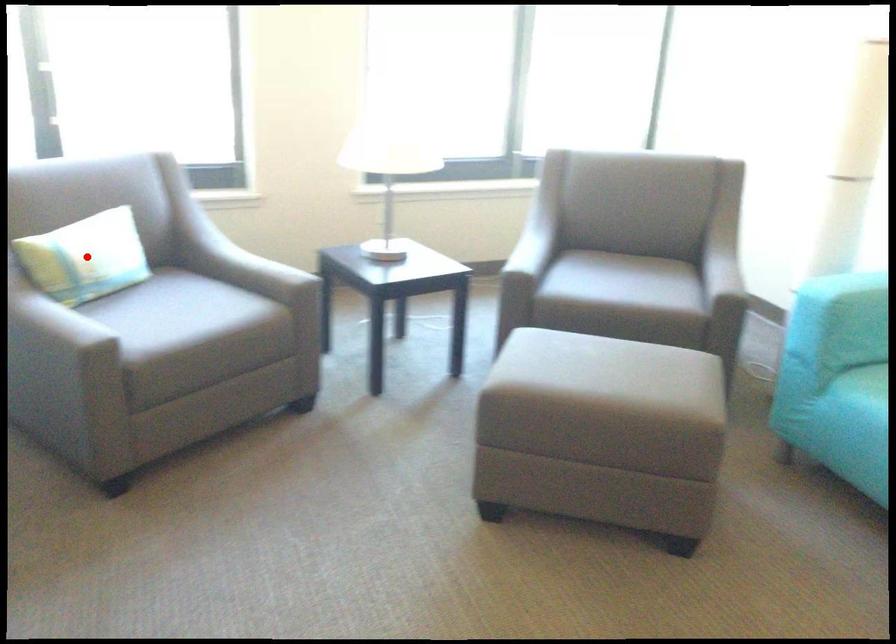
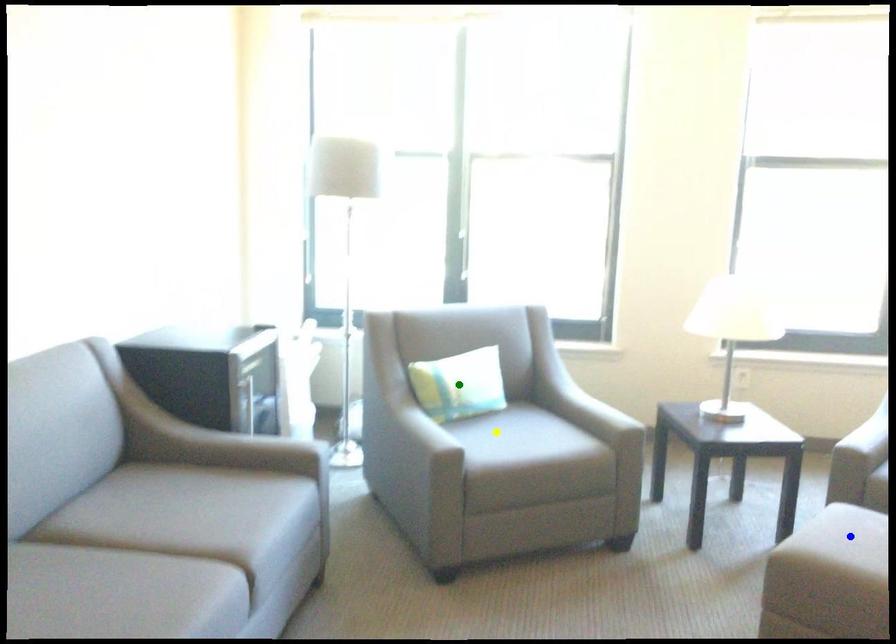
Question: I am providing you with two images of the same scene from different viewpoints. A red point is marked on the first image. You are given multiple points on the second image. Which point in image 2 is actually the same real-world point as the red point in image 1?

Choices:
 (A) yellow point
 (B) blue point
 (C) green point

Answer: (C)